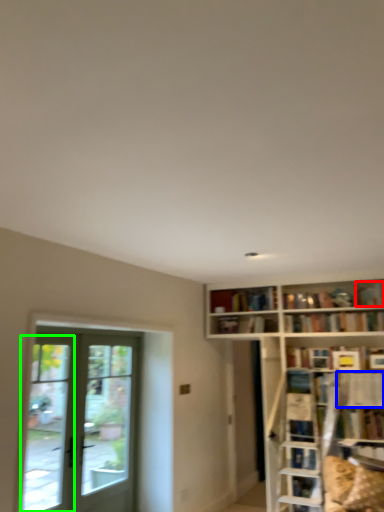
Question: Which object is the closest to the book (highlighted by a red box)? Choose among these: shelf (highlighted by a blue box) or window (highlighted by a green box).

Choices:
 (A) shelf
 (B) window

Answer: (A)